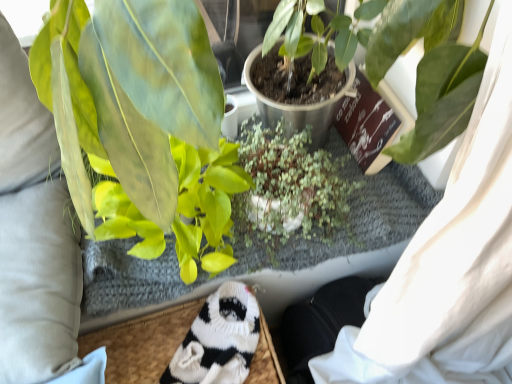
Question: Can you confirm if green matte leafy plant at left, which ranks as the second houseplant in front-to-back order, is taller than white knitted socks at lower left?

Choices:
 (A) no
 (B) yes

Answer: (B)

Question: Is green matte leafy plant at left, which ranks as the second houseplant in front-to-back order, facing away from white knitted socks at lower left?

Choices:
 (A) yes
 (B) no

Answer: (B)

Question: Does green matte leafy plant at left, the second houseplant positioned from the back, have a larger size compared to white knitted socks at lower left?

Choices:
 (A) no
 (B) yes

Answer: (B)

Question: From a real-world perspective, is green matte leafy plant at left, which ranks as the second houseplant in front-to-back order, under white knitted socks at lower left?

Choices:
 (A) no
 (B) yes

Answer: (A)

Question: From the image's perspective, does green matte leafy plant at left, which ranks as the second houseplant in front-to-back order, appear higher than white knitted socks at lower left?

Choices:
 (A) no
 (B) yes

Answer: (B)

Question: Is green matte leafy plant at left, which ranks as the second houseplant in front-to-back order, wider than white knitted socks at lower left?

Choices:
 (A) yes
 (B) no

Answer: (A)

Question: Is green matte plant at center, positioned as the 3th houseplant in back-to-front order, a part of green matte leafy plant at left, the second houseplant positioned from the back?

Choices:
 (A) no
 (B) yes

Answer: (A)

Question: Considering the relative positions of green matte leafy plant at left, which ranks as the second houseplant in front-to-back order, and green matte plant at center, the 1th houseplant when ordered from front to back, in the image provided, is green matte leafy plant at left, which ranks as the second houseplant in front-to-back order, to the right of green matte plant at center, the 1th houseplant when ordered from front to back, from the viewer's perspective?

Choices:
 (A) no
 (B) yes

Answer: (A)

Question: Is green matte leafy plant at left, which ranks as the second houseplant in front-to-back order, turned away from green matte plant at center, positioned as the 3th houseplant in back-to-front order?

Choices:
 (A) no
 (B) yes

Answer: (B)

Question: From the image's perspective, would you say green matte leafy plant at left, the second houseplant positioned from the back, is positioned over green matte plant at center, the 1th houseplant when ordered from front to back?

Choices:
 (A) no
 (B) yes

Answer: (A)

Question: Is green matte leafy plant at left, which ranks as the second houseplant in front-to-back order, far from green matte plant at center, positioned as the 3th houseplant in back-to-front order?

Choices:
 (A) no
 (B) yes

Answer: (A)

Question: Is green matte leafy plant at left, the second houseplant positioned from the back, shorter than green matte plant at center, the 1th houseplant when ordered from front to back?

Choices:
 (A) no
 (B) yes

Answer: (B)

Question: Is green matte leafy plant at left, which ranks as the second houseplant in front-to-back order, taller than green matte plant at center, positioned as the third houseplant in front-to-back order?

Choices:
 (A) no
 (B) yes

Answer: (B)